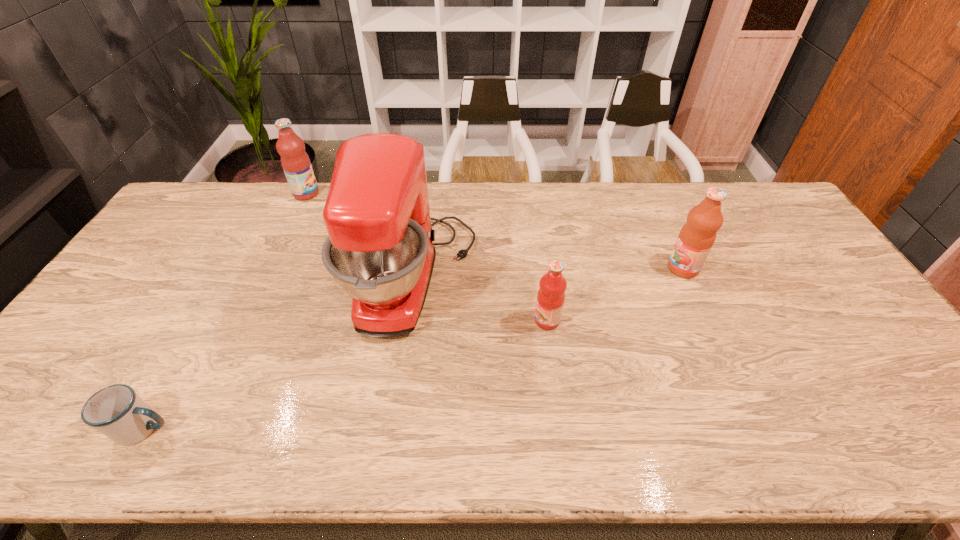
Where is `the third object from right to left`? Image resolution: width=960 pixels, height=540 pixels. the third object from right to left is located at coordinates (380, 250).

This screenshot has width=960, height=540. Identify the location of the tallest object. tap(380, 250).

I want to click on the farthest fruit juice, so click(x=295, y=162).

The height and width of the screenshot is (540, 960). I want to click on the farthest object, so click(x=295, y=162).

Image resolution: width=960 pixels, height=540 pixels. Find the location of `the rightmost fruit juice`. the rightmost fruit juice is located at coordinates (697, 236).

At what (x,y) coordinates should I click in order to perform the action: click on the rightmost object. Please return your answer as a coordinate pair (x, y). The height and width of the screenshot is (540, 960). Looking at the image, I should click on click(x=697, y=236).

Locate an element on the screen. the nearest fruit juice is located at coordinates [x=551, y=295].

Locate an element on the screen. the fourth object from left to right is located at coordinates (551, 295).

Where is `the leftmost object`? This screenshot has width=960, height=540. the leftmost object is located at coordinates (116, 411).

Locate an element on the screen. mug is located at coordinates (116, 411).